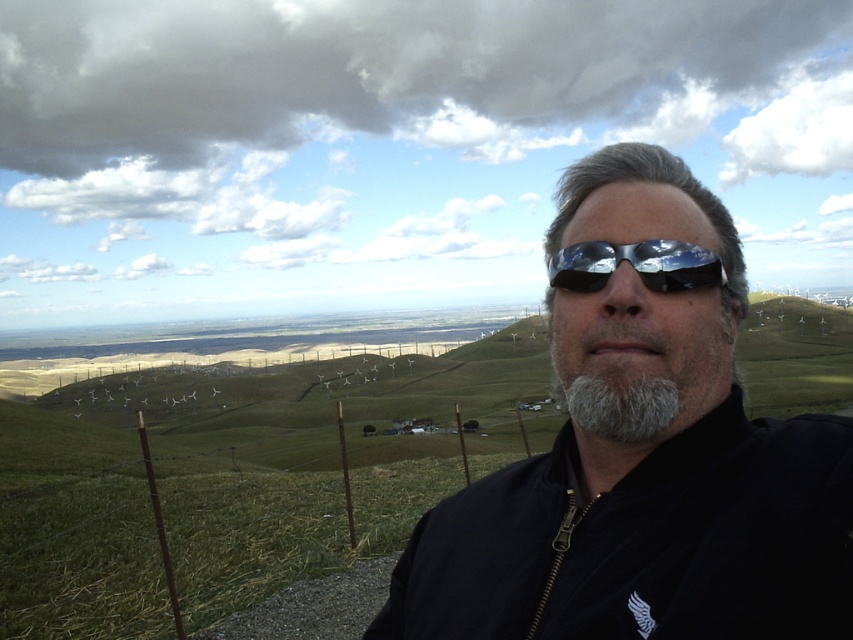
You are a photographer trying to capture the person in the image. Since both the shiny black sunglasses at center and the graysoftbeard at center are at the center, which one should you focus on to ensure the subject is sharp?

You should focus on the shiny black sunglasses at center because it is closer to the viewer than the graysoftbeard at center, so focusing on it will ensure the subject is sharp.

You are a photographer trying to capture the best selfie shot. You notice the shiny black sunglasses at center and the graysoftbeard at center in your frame. Which object is located lower in the image?

The shiny black sunglasses at center is positioned under graysoftbeard at center, so it is located lower in the image.

You are a photographer trying to adjust the focus of your camera to capture the person in the image. The camera has a focus point at point (643, 467). Which object should you focus on to ensure the person wearing the shiny black sunglasses at center is in focus?

The shiny black sunglasses at center is located at point (643, 467), so focusing on that point will ensure the person wearing the shiny black sunglasses at center is in focus.